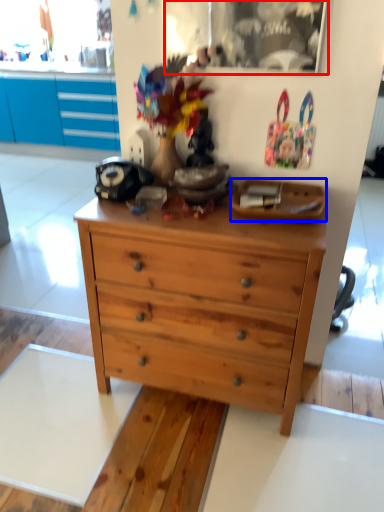
Question: Which point is closer to the camera, picture frame (highlighted by a red box) or plate (highlighted by a blue box)?

Choices:
 (A) picture frame
 (B) plate

Answer: (B)